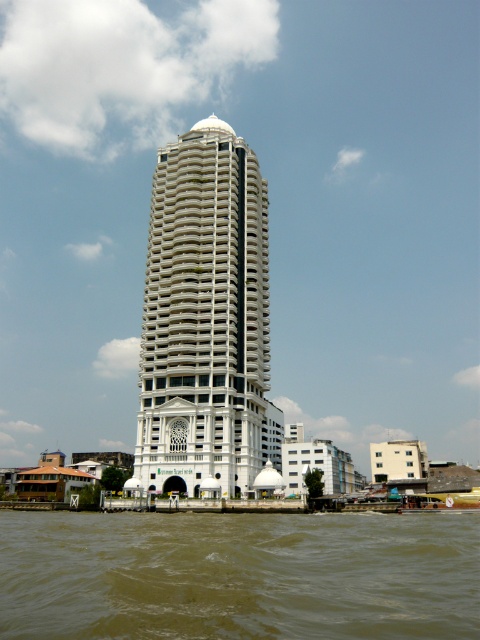
Is brown muddy water at lower center closer to the viewer compared to white matte building at lower right?

Yes, brown muddy water at lower center is closer to the viewer.

Identify the location of brown muddy water at lower center. (239, 577).

Does brown muddy water at lower center appear on the right side of white glossy building at lower center?

Incorrect, brown muddy water at lower center is not on the right side of white glossy building at lower center.

Does brown muddy water at lower center have a greater width compared to white glossy building at lower center?

Indeed, brown muddy water at lower center has a greater width compared to white glossy building at lower center.

Which is behind, point (334, 515) or point (343, 481)?

The point (343, 481) is more distant.

Locate an element on the screen. This screenshot has width=480, height=640. brown muddy water at lower center is located at coordinates (239, 577).

Measure the distance from white glossy building at lower center to white matte building at lower right.

white glossy building at lower center is 11.53 meters away from white matte building at lower right.

Can you confirm if white glossy building at lower center is positioned to the right of white matte building at lower right?

No, white glossy building at lower center is not to the right of white matte building at lower right.

Image resolution: width=480 pixels, height=640 pixels. What do you see at coordinates (319, 465) in the screenshot?
I see `white glossy building at lower center` at bounding box center [319, 465].

Locate an element on the screen. white glossy building at lower center is located at coordinates (319, 465).